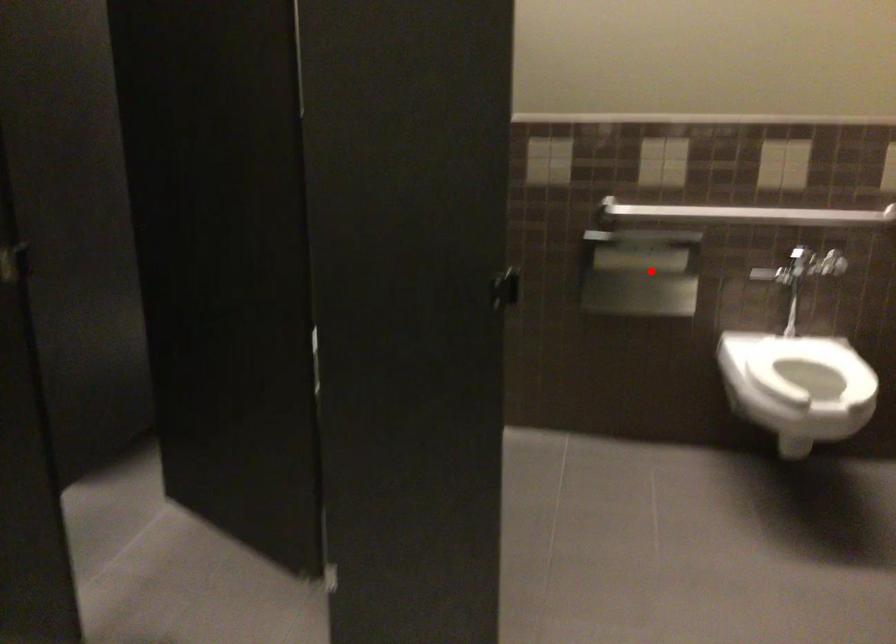
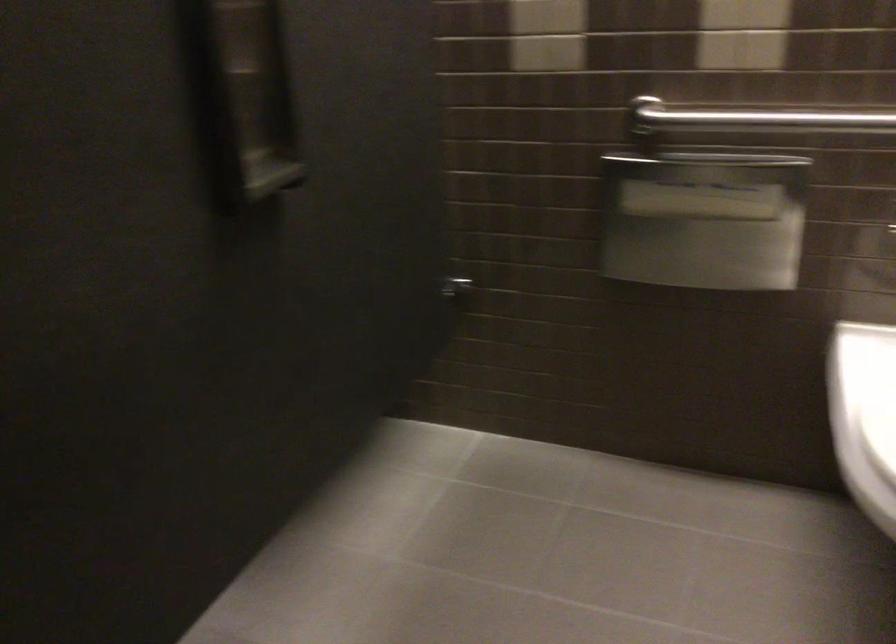
Find the pixel in the second image that matches the highlighted location in the first image.

(703, 220)